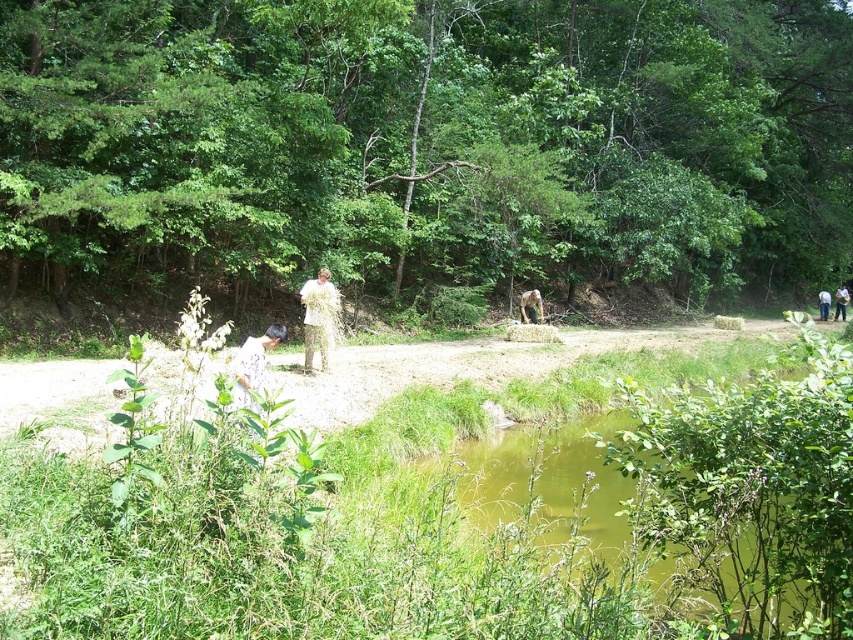
Image resolution: width=853 pixels, height=640 pixels. I want to click on light brown straw at center, so click(316, 317).

Does light brown straw at center come in front of green fabric shirt at right?

Yes, light brown straw at center is in front of green fabric shirt at right.

Is point (310, 305) closer to camera compared to point (840, 291)?

Yes, point (310, 305) is closer to viewer.

You are a GUI agent. You are given a task and a screenshot of the screen. Output one action in this format:
    pyautogui.click(x=<x>, y=<y>)
    Task: Click on the light brown straw at center
    The width and height of the screenshot is (853, 640).
    Given the screenshot: What is the action you would take?
    pyautogui.click(x=316, y=317)

Is green murky water at lower center to the right of white cotton shirt at right from the viewer's perspective?

In fact, green murky water at lower center is to the left of white cotton shirt at right.

Can you confirm if green murky water at lower center is positioned above white cotton shirt at right?

No, green murky water at lower center is not above white cotton shirt at right.

Find the location of a particular element. green murky water at lower center is located at coordinates (698, 497).

Between point (263, 362) and point (300, 301), which one is positioned behind?

The point (300, 301) is more distant.

Can you confirm if white cotton dress at lower left is positioned above light brown straw at center?

No, white cotton dress at lower left is not above light brown straw at center.

You are a GUI agent. You are given a task and a screenshot of the screen. Output one action in this format:
    pyautogui.click(x=<x>, y=<y>)
    Task: Click on the white cotton dress at lower left
    This screenshot has height=640, width=853.
    Given the screenshot: What is the action you would take?
    pyautogui.click(x=253, y=364)

Identify the location of white cotton dress at lower left. The width and height of the screenshot is (853, 640). (253, 364).